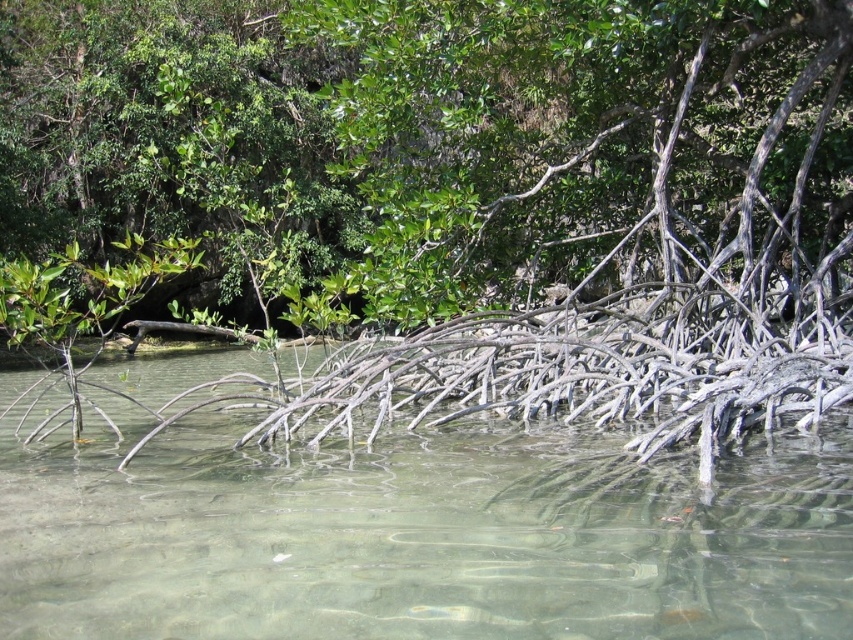
You are standing in a mangrove forest and want to reach a specific location marked by the point at coordinates (703, 81). Given that you can walk at a speed of 3 feet per second, how many seconds will it take you to reach that point from your current position?

The point at coordinates (703, 81) is 44.66 feet away from the camera. At a walking speed of 3 feet per second, it will take approximately 14.89 seconds to reach the point. This is calculated by dividing the distance by the speed.

You are a bird flying over the mangrove forest. You see a point at coordinates (399, 125). Which object in the scene does this point belong to?

The point at coordinates (399, 125) is on the green leafy tree at upper center.